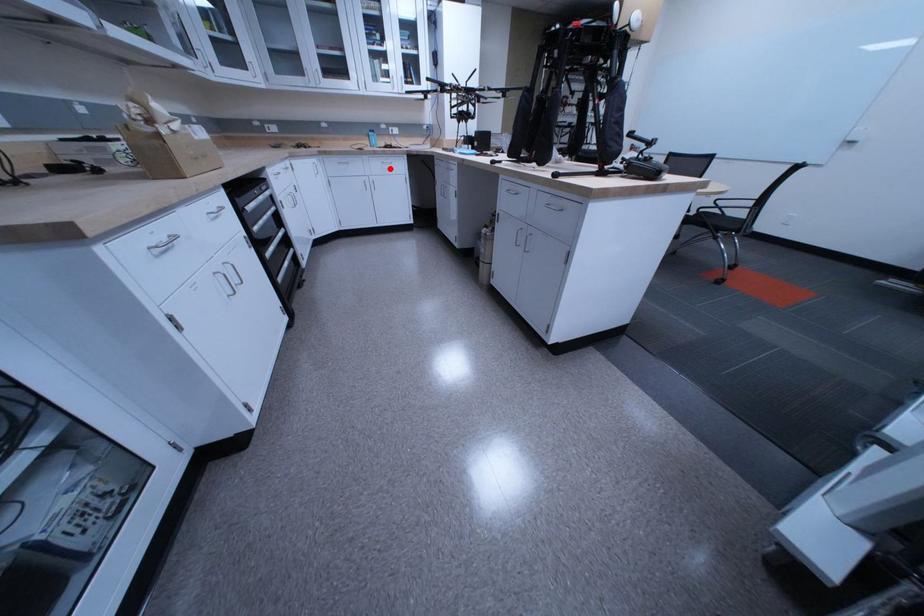
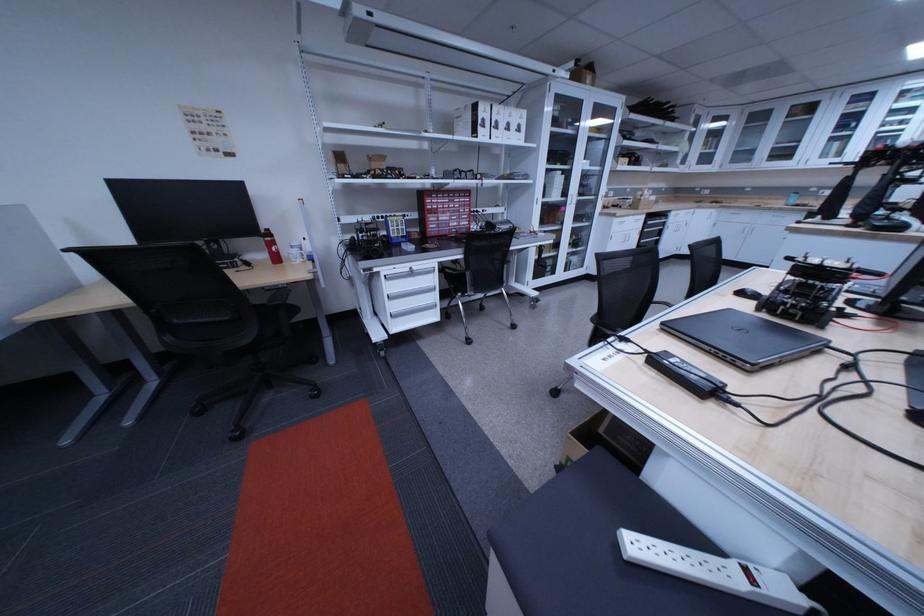
Locate, in the second image, the point that corresponds to the highlighted location in the first image.

(779, 220)